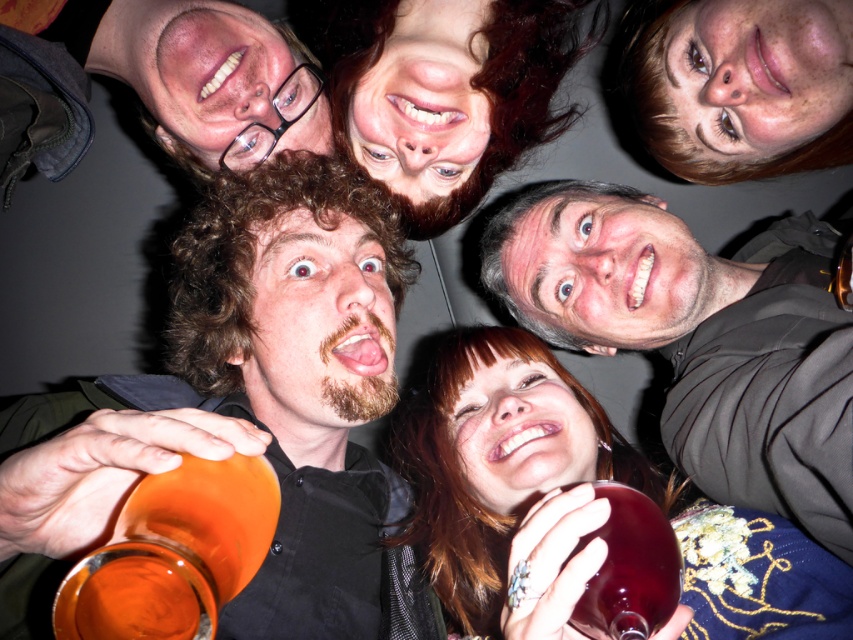
Does smooth black shirt at center have a lesser height compared to translucent glass wine at center?

Incorrect, smooth black shirt at center's height does not fall short of translucent glass wine at center's.

I want to click on smooth black shirt at center, so click(x=700, y=337).

Is orange glass mug at center positioned in front of smooth black shirt at center?

Yes, it is.

Is point (357, 196) farther from camera compared to point (726, 424)?

Yes, it is behind point (726, 424).

Is point (332, 596) behind point (798, 509)?

That is True.

Image resolution: width=853 pixels, height=640 pixels. I want to click on orange glass mug at center, so click(x=299, y=381).

Between smooth black shirt at center and orange glass at lower left, which one appears on the right side from the viewer's perspective?

From the viewer's perspective, smooth black shirt at center appears more on the right side.

Is point (840, 371) closer to camera compared to point (169, 632)?

That is False.

Based on the photo, who is more distant from viewer, (747, 467) or (227, 483)?

The point (747, 467) is more distant.

What are the coordinates of `smooth black shirt at center` in the screenshot? It's located at (700, 337).